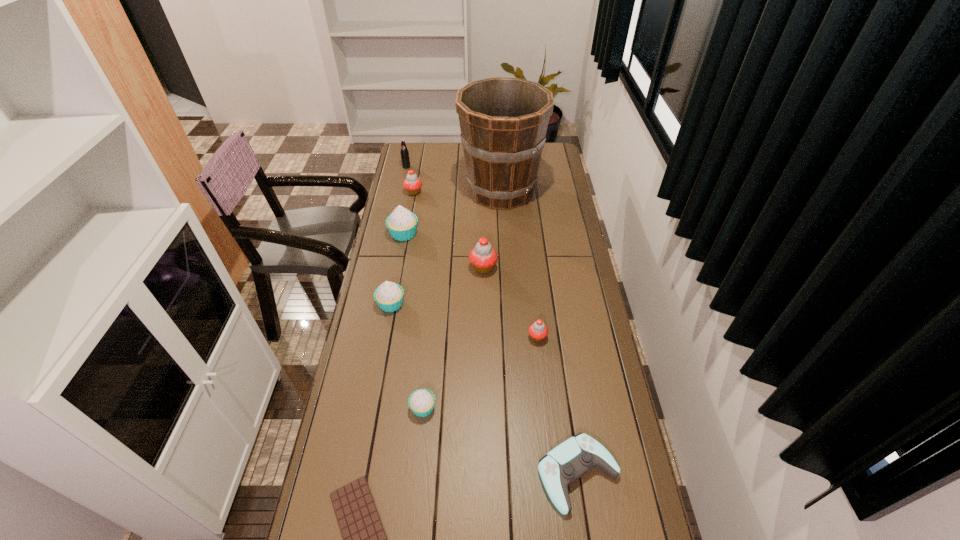
Where is `free region at the left edge`? The image size is (960, 540). free region at the left edge is located at coordinates (408, 252).

Image resolution: width=960 pixels, height=540 pixels. In order to click on vacant space at the right edge of the desktop in this screenshot , I will do `click(566, 335)`.

Find the location of a particular element. vacant space at the far left corner of the desktop is located at coordinates (415, 164).

Find the location of a particular element. vacant point located between the leftmost red cupcake and the second biggest white cupcake is located at coordinates (402, 248).

Where is `vacant space that's between the rightmost white cupcake and the pop`? Image resolution: width=960 pixels, height=540 pixels. vacant space that's between the rightmost white cupcake and the pop is located at coordinates (415, 287).

Where is `vacant region between the farthest white cupcake and the bucket`? The image size is (960, 540). vacant region between the farthest white cupcake and the bucket is located at coordinates (452, 212).

This screenshot has width=960, height=540. I want to click on empty location between the bucket and the second smallest red cupcake, so click(457, 192).

Where is `free space between the second smallest white cupcake and the second smallest red cupcake`? The width and height of the screenshot is (960, 540). free space between the second smallest white cupcake and the second smallest red cupcake is located at coordinates (402, 248).

The width and height of the screenshot is (960, 540). What are the coordinates of `vacant space that's between the second smallest white cupcake and the biggest white cupcake` in the screenshot? It's located at (397, 269).

Identify which object is located as the ninth nearest to the farthest red cupcake. Please provide its 2D coordinates. Your answer should be formatted as a tuple, i.e. [(x, y)], where the tuple contains the x and y coordinates of a point satisfying the conditions above.

[(364, 539)]